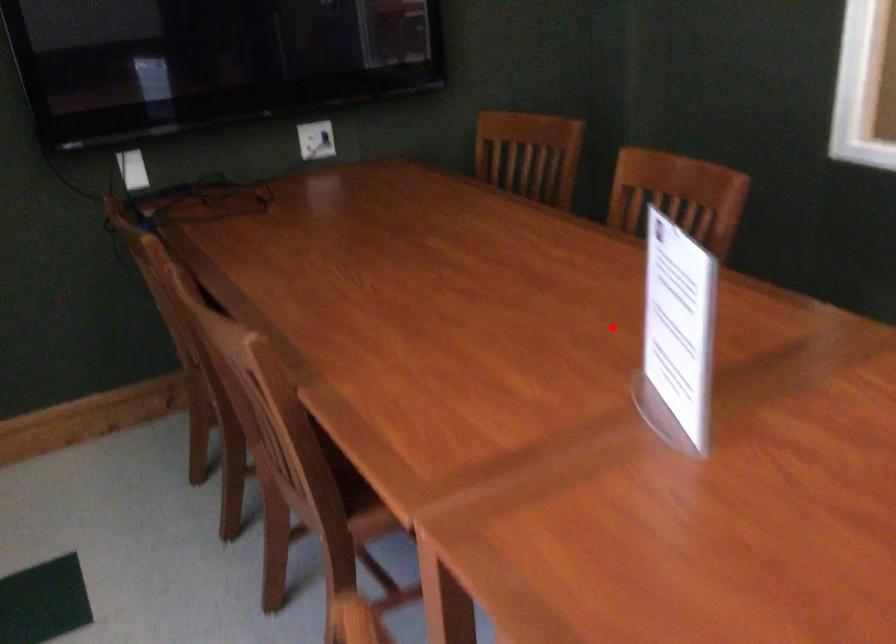
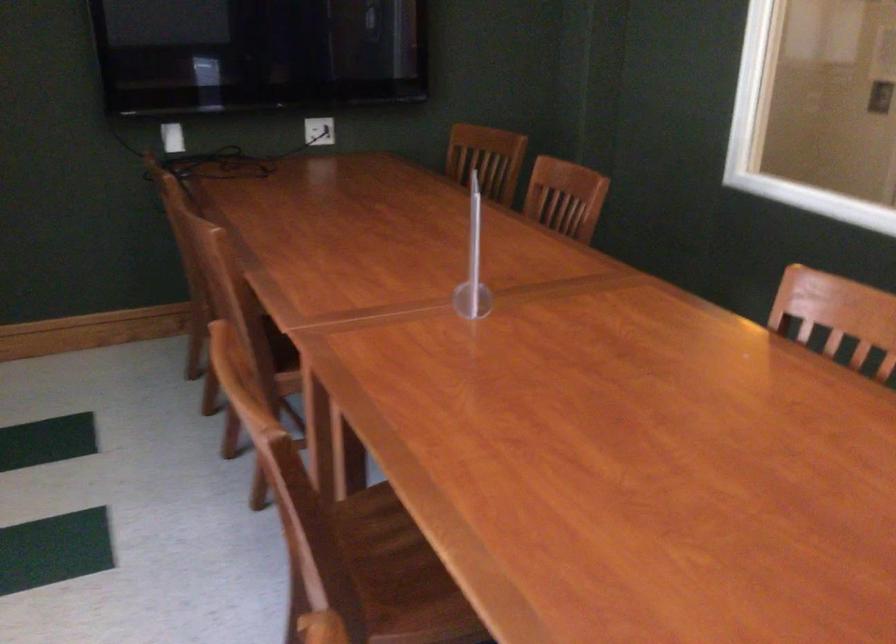
Question: I am providing you with two images of the same scene from different viewpoints. In image1, a red point is highlighted. Considering the same 3D point in image2, which of the following is correct?

Choices:
 (A) It is closer
 (B) It is farther

Answer: (B)